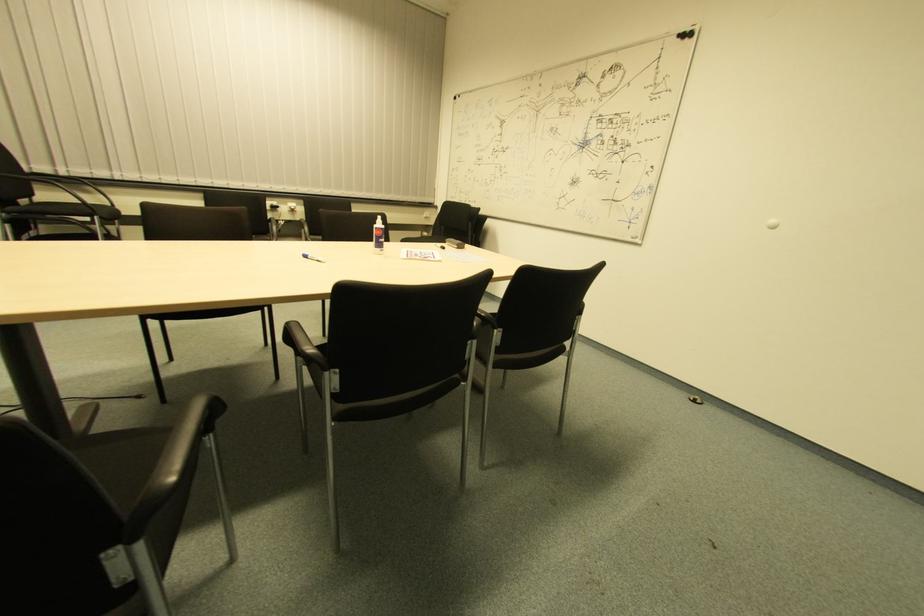
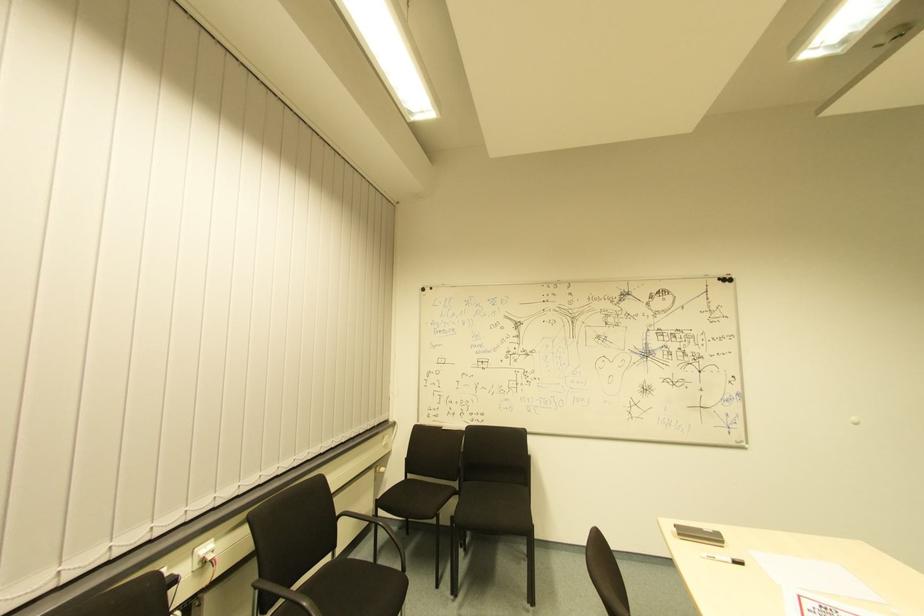
In the second image, find the point that corresponds to (456,100) in the first image.

(427, 293)